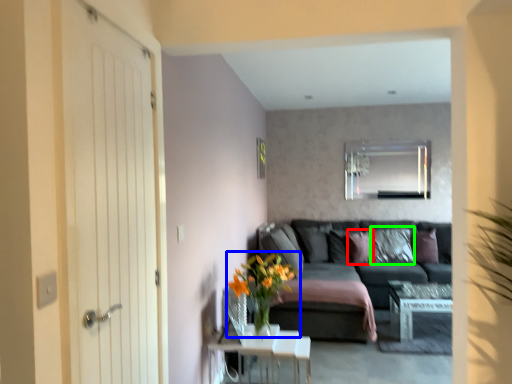
Question: Which object is the farthest from pillow (highlighted by a red box)? Choose among these: floral arrangement (highlighted by a blue box) or pillow (highlighted by a green box).

Choices:
 (A) floral arrangement
 (B) pillow

Answer: (A)